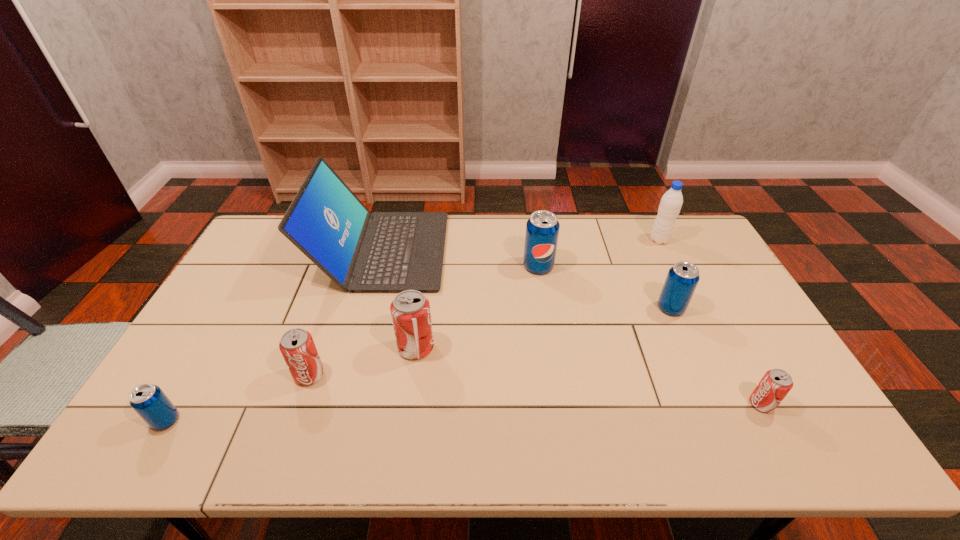
You are a GUI agent. You are given a task and a screenshot of the screen. Output one action in this format:
    pyautogui.click(x=<x>, y=<y>)
    Task: Click on the free location located 0.170m on the back of the leftmost soda can
    The image size is (960, 540).
    Given the screenshot: What is the action you would take?
    pyautogui.click(x=204, y=353)

Where is `vacant point located on the front of the rightmost soda can`? This screenshot has height=540, width=960. vacant point located on the front of the rightmost soda can is located at coordinates (781, 442).

Locate an element on the screen. laptop computer present at the far edge is located at coordinates (360, 251).

Find the location of a particular element. water bottle positioned at the far edge is located at coordinates point(671,202).

Image resolution: width=960 pixels, height=540 pixels. Identify the location of object present at the near edge. (148, 400).

Identify the location of object that is positioned at the left edge. (148, 400).

The image size is (960, 540). Identify the location of water bottle that is positioned at the right edge. (671, 202).

At what (x,y) coordinates should I click in order to perform the action: click on soda can present at the right edge. Please return your answer as a coordinate pair (x, y). Looking at the image, I should click on (776, 383).

At what (x,y) coordinates should I click in order to perform the action: click on object that is at the near left corner. Please return your answer as a coordinate pair (x, y). The height and width of the screenshot is (540, 960). Looking at the image, I should click on (148, 400).

At what (x,y) coordinates should I click in order to perform the action: click on object at the far right corner. Please return your answer as a coordinate pair (x, y). Looking at the image, I should click on (x=671, y=202).